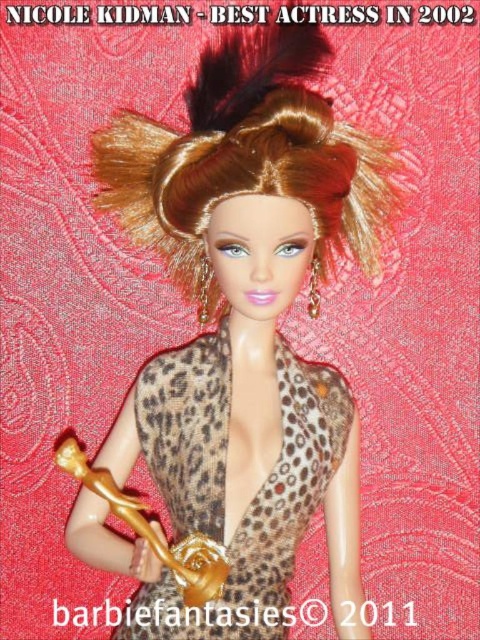
Looking at the doll styled like Nicole Kidman, which object has a greater width between the shiny brown hair at center and the leopard print fabric dress at center?

The shiny brown hair at center has a greater width than the leopard print fabric dress at center.

You are a photographer setting up a shot of the Nicole Kidman doll holding the Oscar statuette. You need to position a spotlight exactly at point (x=205, y=177). Since the spotlight needs to be placed at the same distance as the doll from the camera, will the spotlight be placed correctly if you set it at 95.39 centimeters?

Yes, the spotlight should be placed correctly at 95.39 centimeters because the distance of point (x=205, y=177) from the camera is exactly 95.39 centimeters, matching the required distance for the spotlight placement.